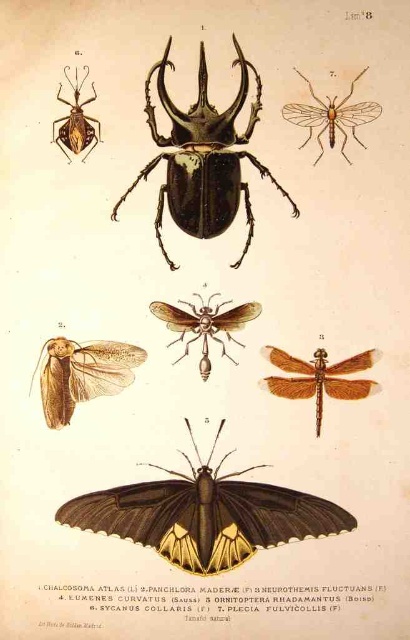
Is brown translucent dragonfly at center-right above translucent yellowish wings at upper right?

Incorrect, brown translucent dragonfly at center-right is not positioned above translucent yellowish wings at upper right.

Between brown translucent dragonfly at center-right and translucent yellowish wings at upper right, which one is positioned lower?

Positioned lower is brown translucent dragonfly at center-right.

Is point (316, 385) less distant than point (305, 106)?

Yes.

You are a GUI agent. You are given a task and a screenshot of the screen. Output one action in this format:
    pyautogui.click(x=<x>, y=<y>)
    Task: Click on the brown translucent dragonfly at center-right
    The image size is (410, 640).
    Given the screenshot: What is the action you would take?
    pyautogui.click(x=318, y=378)

Between glossy black beetle at center and brown matte moth at lower left, which one appears on the right side from the viewer's perspective?

From the viewer's perspective, glossy black beetle at center appears more on the right side.

Measure the distance between glossy black beetle at center and camera.

They are 35.90 meters apart.

I want to click on glossy black beetle at center, so [202, 157].

Locate an element on the screen. black glossy butterfly at bottom is located at coordinates (205, 515).

Which of these two, black glossy butterfly at bottom or translucent yellowish wings at upper right, stands shorter?

translucent yellowish wings at upper right

Between point (202, 467) and point (291, 122), which one is positioned in front?

Point (202, 467) is in front.

Find the location of a particular element. This screenshot has width=410, height=640. black glossy butterfly at bottom is located at coordinates (205, 515).